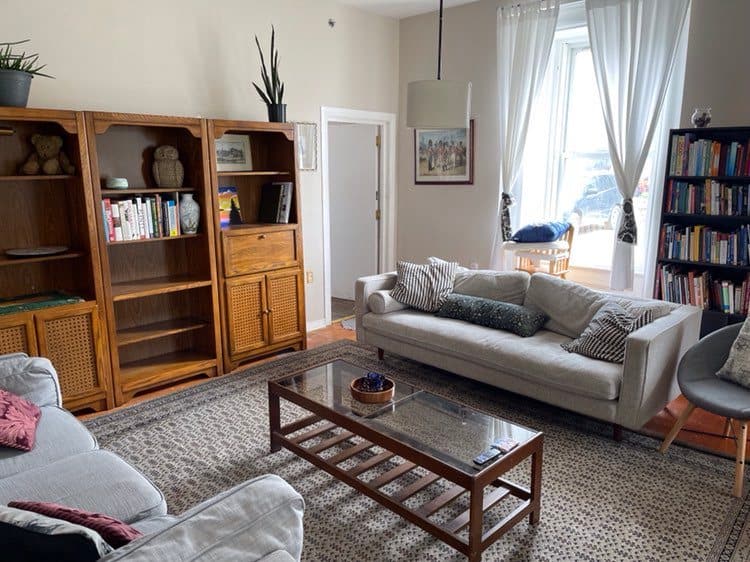
Locate an element on the screen. The height and width of the screenshot is (562, 750). sofa is located at coordinates (516, 350), (66, 488).